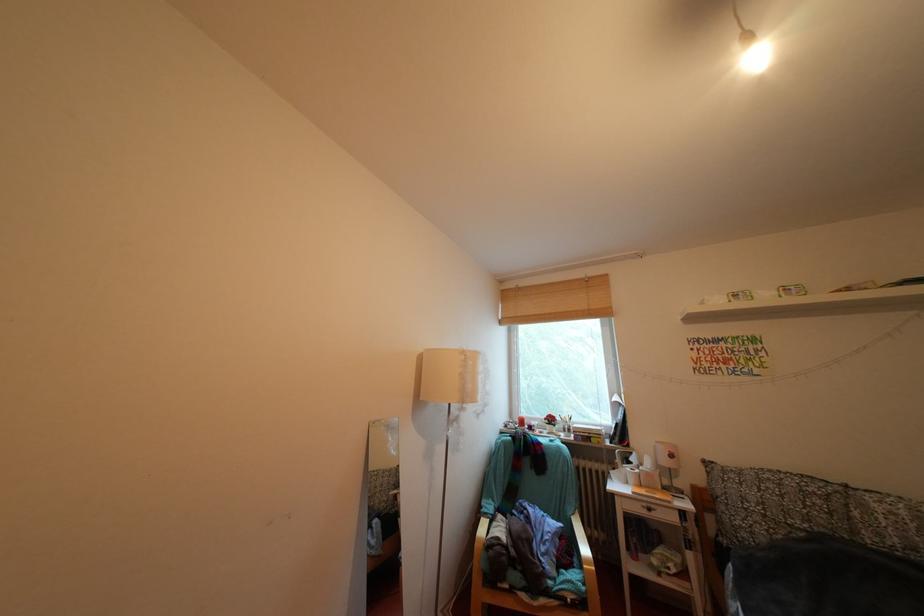
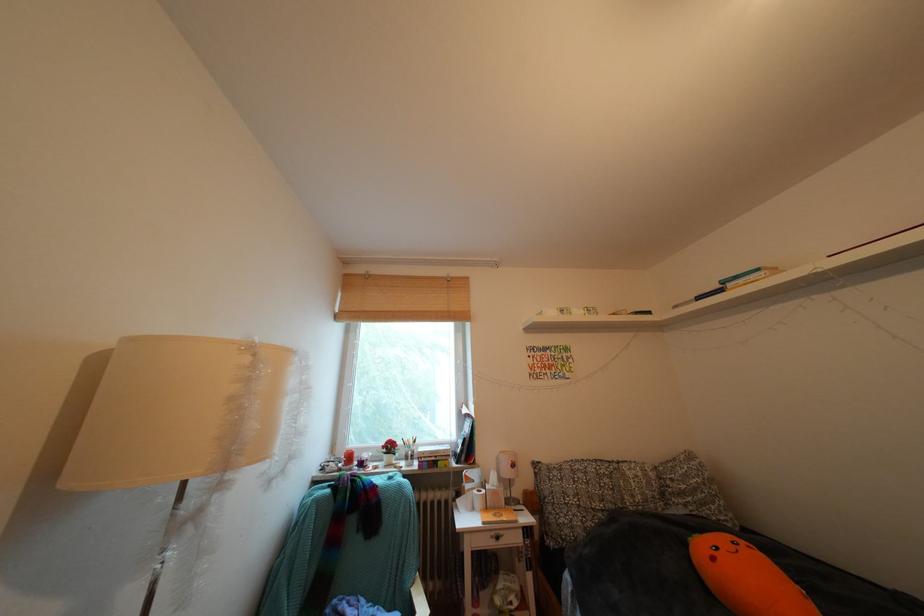
Where in the second image is the point corresponding to point 528,294 from the first image?

(379, 282)